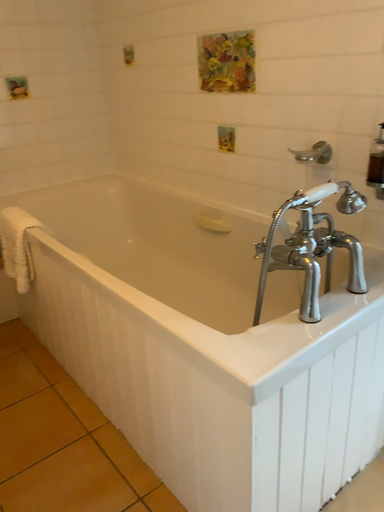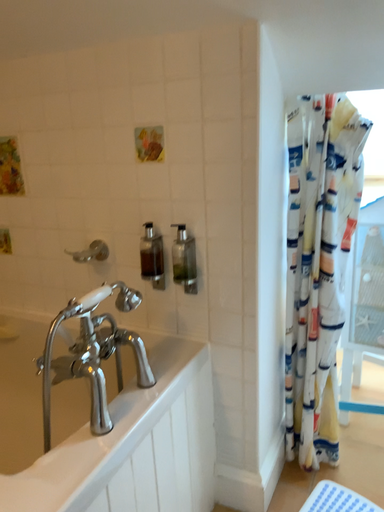
Question: Which way did the camera rotate in the video?

Choices:
 (A) rotated left
 (B) rotated right

Answer: (B)